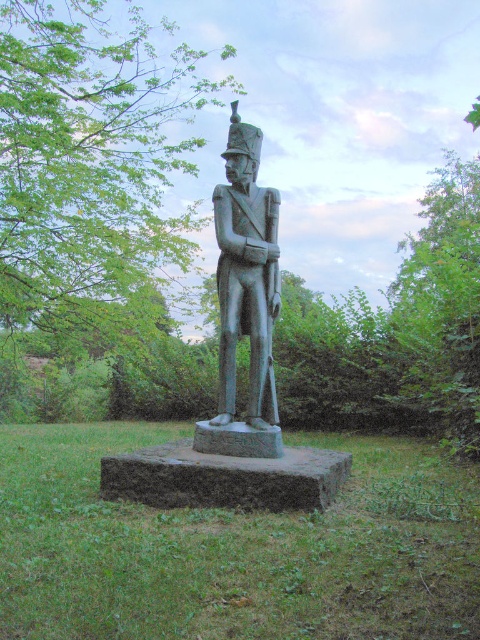
Question: Which point is closer to the camera?

Choices:
 (A) (228, 336)
 (B) (132, 92)

Answer: (A)

Question: Does green leafy tree at upper center appear on the left side of bronze statue at center?

Choices:
 (A) no
 (B) yes

Answer: (B)

Question: Which of the following is the closest to the observer?

Choices:
 (A) bronze statue at center
 (B) green leafy tree at upper center

Answer: (A)

Question: Does green leafy tree at upper center come behind bronze statue at center?

Choices:
 (A) no
 (B) yes

Answer: (B)

Question: Is green leafy tree at upper center thinner than bronze statue at center?

Choices:
 (A) no
 (B) yes

Answer: (A)